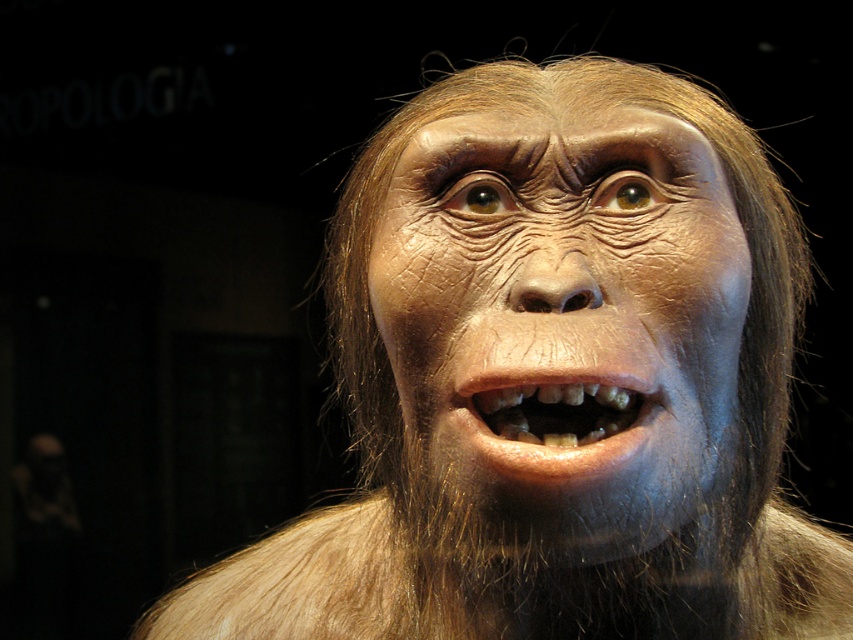
Question: Is the position of matte brown face at center more distant than that of brown textured teeth at center?

Choices:
 (A) yes
 (B) no

Answer: (B)

Question: Among these points, which one is farthest from the camera?

Choices:
 (A) (480, 337)
 (B) (549, 413)

Answer: (B)

Question: Considering the relative positions of matte brown face at center and brown textured teeth at center in the image provided, where is matte brown face at center located with respect to brown textured teeth at center?

Choices:
 (A) below
 (B) above

Answer: (B)

Question: Which point is farther to the camera?

Choices:
 (A) (405, 244)
 (B) (635, 442)

Answer: (A)

Question: Can you confirm if matte brown face at center is positioned to the left of brown textured teeth at center?

Choices:
 (A) no
 (B) yes

Answer: (A)

Question: Among these points, which one is nearest to the camera?

Choices:
 (A) (648, 403)
 (B) (619, 397)

Answer: (B)